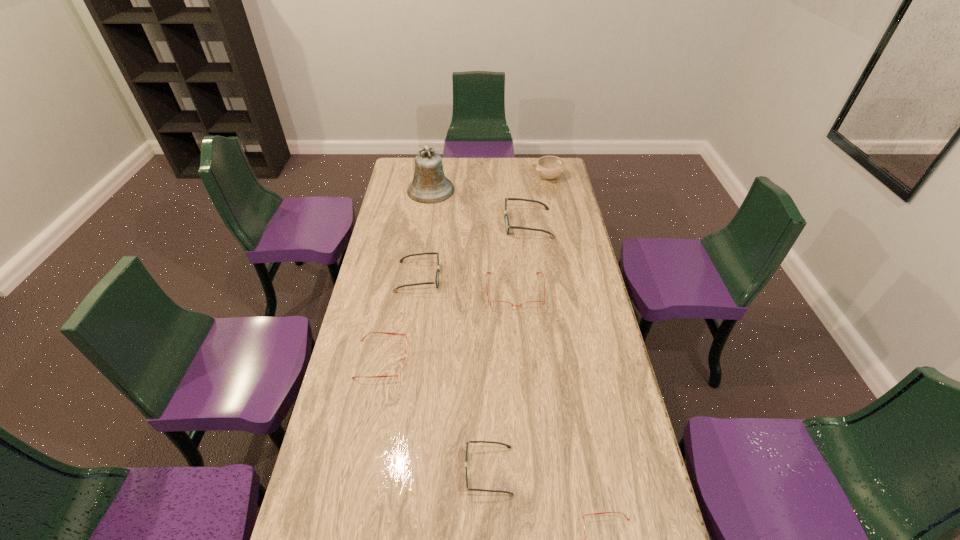
Image resolution: width=960 pixels, height=540 pixels. I want to click on bell, so [x=429, y=185].

Identify the location of bowl. pyautogui.click(x=550, y=167).

Find the location of `the farthest gray spectacles`. the farthest gray spectacles is located at coordinates (507, 225).

The image size is (960, 540). Find the location of `the tallest spectacles`. the tallest spectacles is located at coordinates (507, 225).

The image size is (960, 540). I want to click on the second biggest gray spectacles, so click(436, 281).

Identify the location of the second nearest gray spectacles. (436, 281).

The width and height of the screenshot is (960, 540). I want to click on the biggest pink spectacles, so click(499, 305).

Identify the location of the second pink spectacles from left to right. This screenshot has width=960, height=540. pyautogui.click(x=499, y=305).

Locate an element on the screen. The height and width of the screenshot is (540, 960). the smallest gray spectacles is located at coordinates pyautogui.click(x=467, y=443).

I want to click on the second gray spectacles from right to left, so click(467, 443).